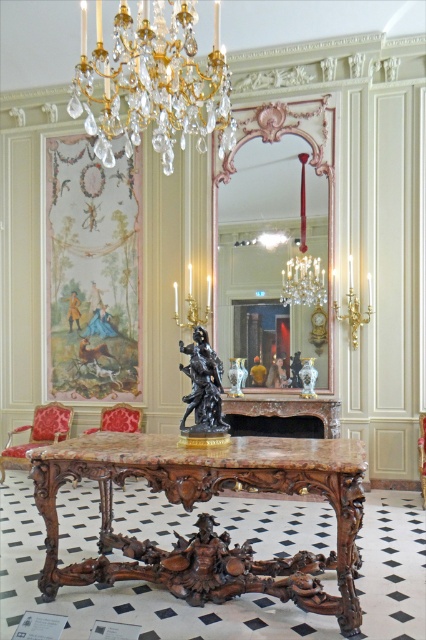
Can you confirm if crystal/glass chandelier at upper center is shorter than gold upholstered chair at center?

No.

Is point (164, 26) closer to camera compared to point (417, 442)?

That is True.

This screenshot has height=640, width=426. Identify the location of crystal/glass chandelier at upper center. (154, 81).

Is point (224, 438) positioned after point (63, 422)?

No, it is in front of (63, 422).

Can you confirm if black polished marble statue at center is positioned below velvet red chair at left?

Actually, black polished marble statue at center is above velvet red chair at left.

Is point (193, 364) positioned before point (52, 440)?

That is True.

You are a GUI agent. You are given a task and a screenshot of the screen. Output one action in this format:
    pyautogui.click(x=<x>, y=<y>)
    Task: Click on the black polished marble statue at center
    
    Given the screenshot: What is the action you would take?
    pyautogui.click(x=203, y=394)

Is marble/wooden table at center above velvet red chair at left?

Yes, marble/wooden table at center is above velvet red chair at left.

Image resolution: width=426 pixels, height=640 pixels. Describe the element at coordinates (209, 515) in the screenshot. I see `marble/wooden table at center` at that location.

Where is `marble/wooden table at center`? This screenshot has height=640, width=426. marble/wooden table at center is located at coordinates (209, 515).